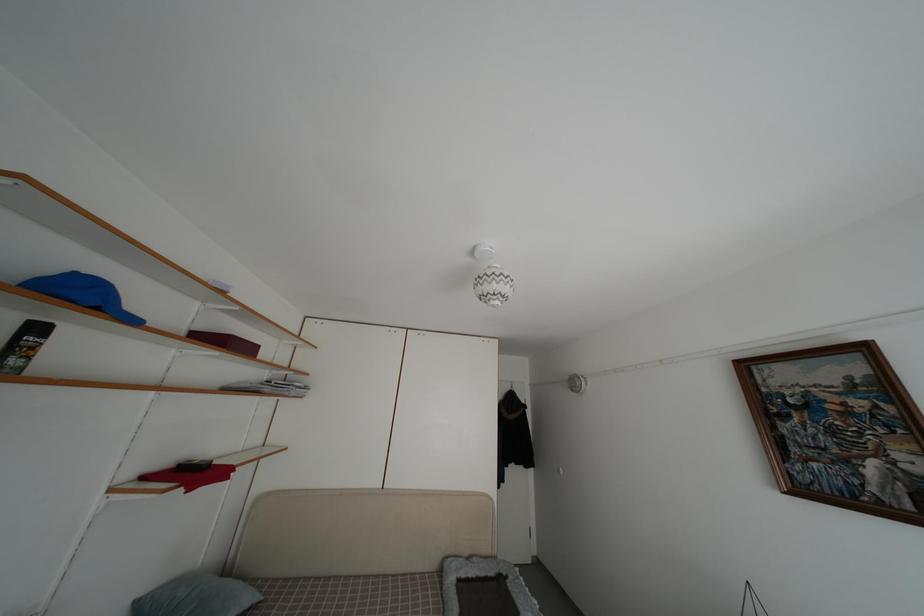
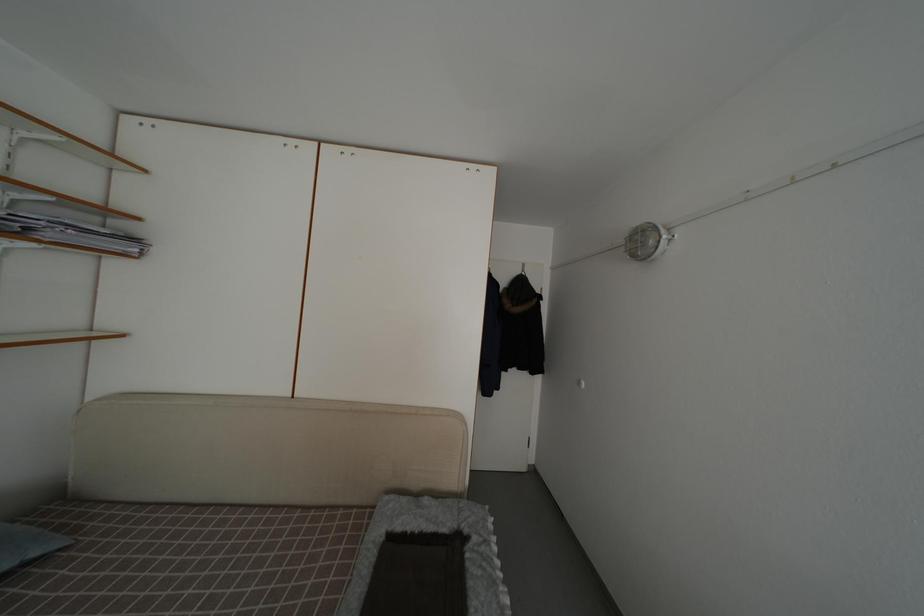
Question: In a continuous first-person perspective shot, in which direction is the camera moving?

Choices:
 (A) Left
 (B) Right
 (C) Forward
 (D) Backward

Answer: (C)